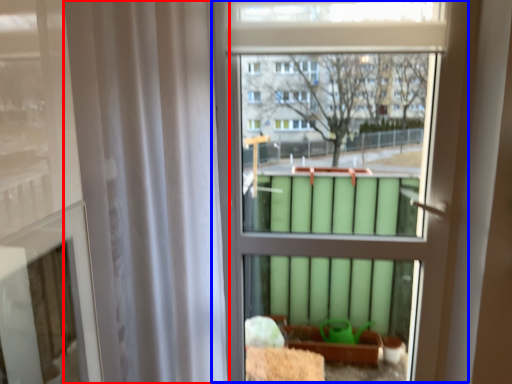
Question: Which of the following is the farthest to the observer, shower curtain (highlighted by a red box) or bay window (highlighted by a blue box)?

Choices:
 (A) shower curtain
 (B) bay window

Answer: (B)